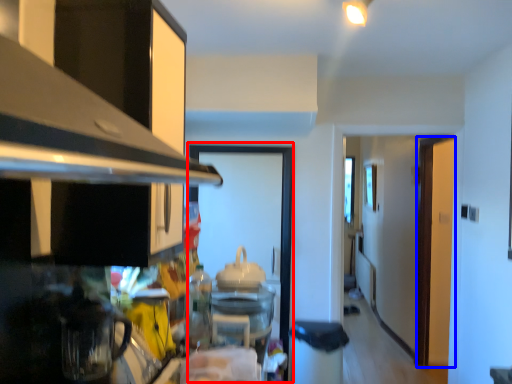
Question: Which of the following is the farthest to the observer, glass door (highlighted by a red box) or door (highlighted by a blue box)?

Choices:
 (A) glass door
 (B) door

Answer: (B)